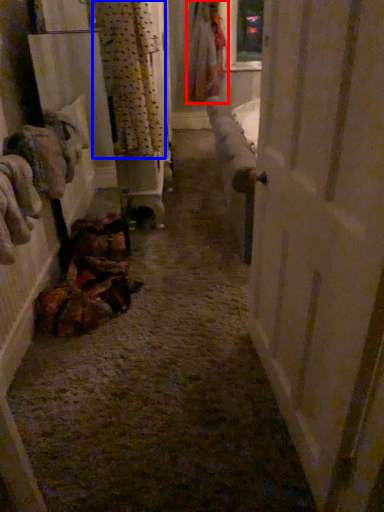
Question: Which object is further to the camera taking this photo, clothing (highlighted by a red box) or curtain (highlighted by a blue box)?

Choices:
 (A) clothing
 (B) curtain

Answer: (A)